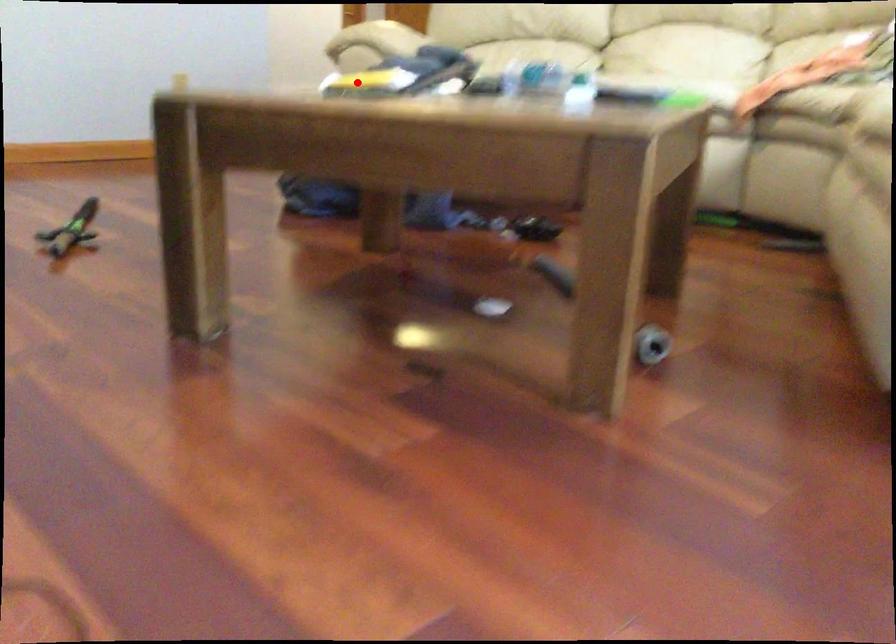
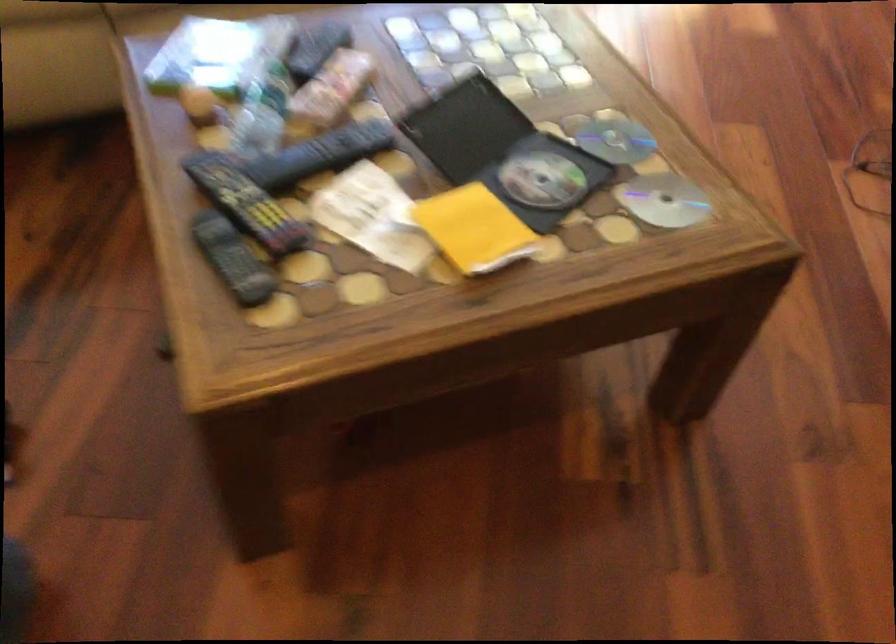
Question: I am providing you with two images of the same scene from different viewpoints. A red point is shown in image1. For the corresponding object point in image2, is it positioned nearer or farther from the camera?

Choices:
 (A) Nearer
 (B) Farther

Answer: (A)